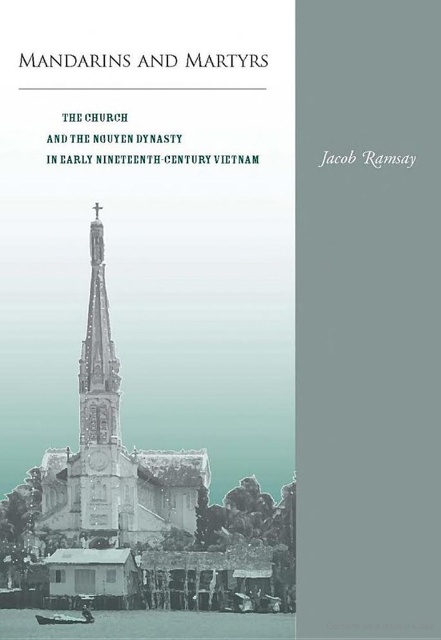
You are an art student analyzing the book cover. The scene shows a stone church steeple at center and a wooden boat at lower left. Which object takes up more space in the image?

The stone church steeple at center is larger in size than the wooden boat at lower left, so it takes up more space in the image.

Looking at the book cover, there is a point marked at coordinates (112, 449). Which object on the cover does this point correspond to?

The point at coordinates (112, 449) corresponds to the stone church steeple at center.

You are a photographer standing in the scene depicted on the book cover. You need to place a small tripod between the clear water at lower center and the wooden boat at lower left. Based on their widths, which object should the tripod be closer to?

The clear water at lower center is wider than the wooden boat at lower left, so the tripod should be placed closer to the wooden boat at lower left to ensure stability between the two objects.